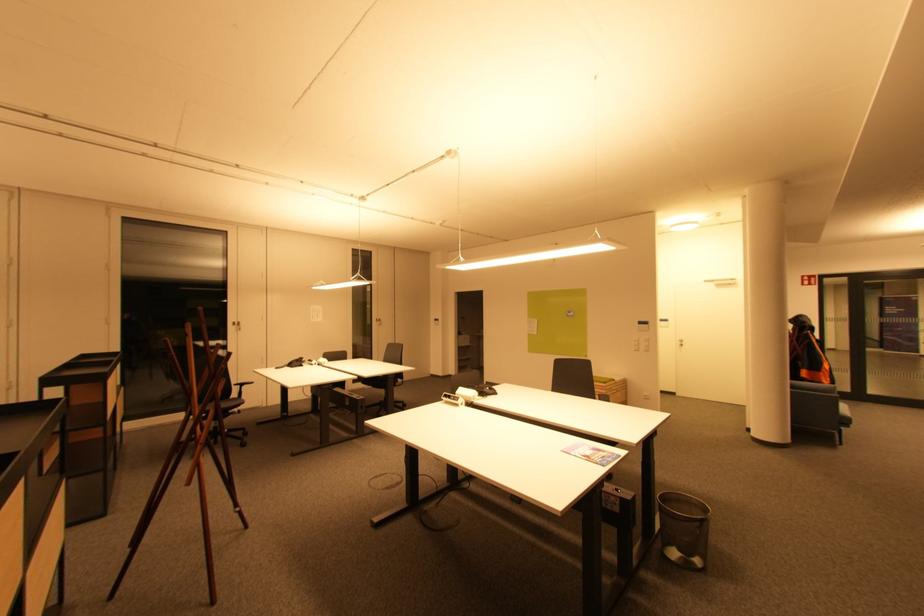
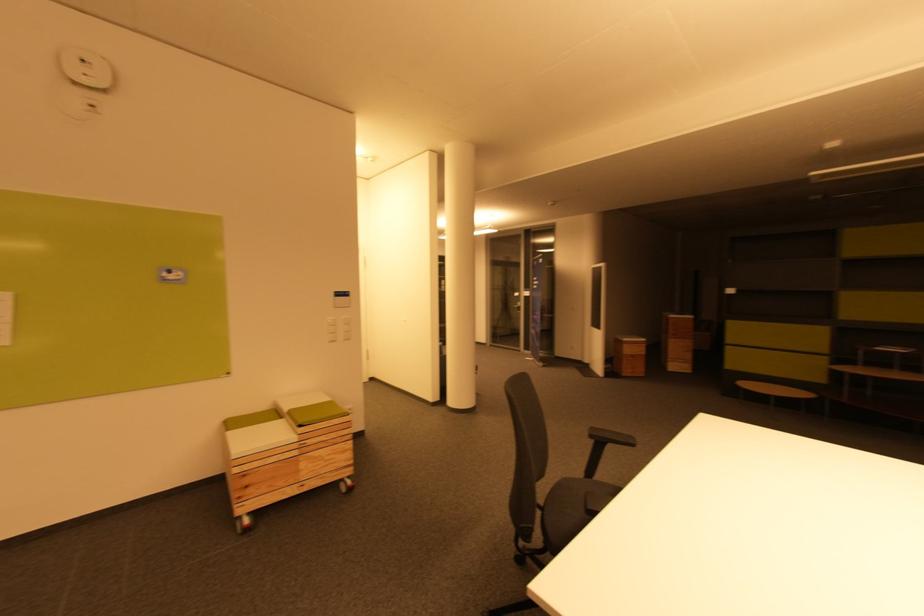
Question: I am providing you with two images of the same scene from different viewpoints. Please identify which objects are invisible in image2.

Choices:
 (A) white light switch
 (B) green seat cushion
 (C) wooden rolling stool
 (D) none of these

Answer: (D)